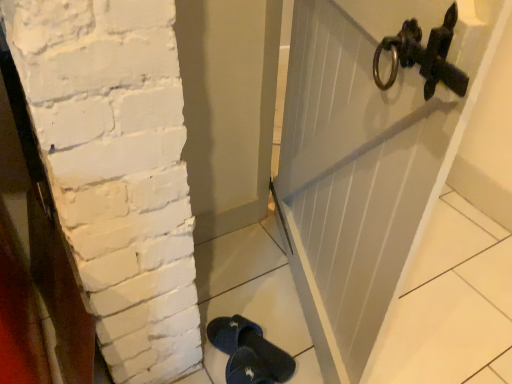
What do you see at coordinates (355, 170) in the screenshot? I see `white painted wood door at upper right` at bounding box center [355, 170].

Image resolution: width=512 pixels, height=384 pixels. Find the location of `white painted wood door at upper right`. white painted wood door at upper right is located at coordinates (355, 170).

In order to face white painted wood door at upper right, should I rotate leftwards or rightwards?

A 13.536 degree turn to the right will do.

What is the approximate width of white painted wood door at upper right?

It is 5.32 inches.

Measure the distance between white painted wood door at upper right and camera.

46.15 centimeters.

What do you see at coordinates (249, 352) in the screenshot? I see `dark blue fabric slipper at lower center` at bounding box center [249, 352].

At what (x,y) coordinates should I click in order to perform the action: click on dark blue fabric slipper at lower center. Please return your answer as a coordinate pair (x, y). The width and height of the screenshot is (512, 384). Looking at the image, I should click on (249, 352).

The width and height of the screenshot is (512, 384). I want to click on white painted wood door at upper right, so click(x=355, y=170).

Considering the positions of objects dark blue fabric slipper at lower center and white painted wood door at upper right in the image provided, who is more to the right, dark blue fabric slipper at lower center or white painted wood door at upper right?

Positioned to the right is white painted wood door at upper right.

Which object is further away from the camera, dark blue fabric slipper at lower center or white painted wood door at upper right?

white painted wood door at upper right is further away from the camera.

Which is behind, point (275, 376) or point (352, 58)?

The point (275, 376) is farther.

From the image's perspective, is dark blue fabric slipper at lower center positioned above or below white painted wood door at upper right?

Based on their image positions, dark blue fabric slipper at lower center is located beneath white painted wood door at upper right.

From a real-world perspective, is dark blue fabric slipper at lower center below white painted wood door at upper right?

Yes, from a real-world perspective, dark blue fabric slipper at lower center is below white painted wood door at upper right.

Considering the sizes of dark blue fabric slipper at lower center and white painted wood door at upper right in the image, is dark blue fabric slipper at lower center wider or thinner than white painted wood door at upper right?

dark blue fabric slipper at lower center is wider than white painted wood door at upper right.

In terms of height, does dark blue fabric slipper at lower center look taller or shorter compared to white painted wood door at upper right?

dark blue fabric slipper at lower center is shorter than white painted wood door at upper right.

Based on the photo, between dark blue fabric slipper at lower center and white painted wood door at upper right, which one has larger size?

With larger size is white painted wood door at upper right.

Would you say dark blue fabric slipper at lower center contains white painted wood door at upper right?

No, white painted wood door at upper right is not surrounded by dark blue fabric slipper at lower center.

Are dark blue fabric slipper at lower center and white painted wood door at upper right making contact?

No, dark blue fabric slipper at lower center is not with white painted wood door at upper right.

Is dark blue fabric slipper at lower center positioned with its back to white painted wood door at upper right?

dark blue fabric slipper at lower center is not turned away from white painted wood door at upper right.

How much distance is there between dark blue fabric slipper at lower center and white painted wood door at upper right?

dark blue fabric slipper at lower center and white painted wood door at upper right are 19.39 inches apart.

In order to click on footwear below the white painted wood door at upper right (from the image's perspective) in this screenshot , I will do `click(249, 352)`.

Is white painted wood door at upper right to the left of dark blue fabric slipper at lower center from the viewer's perspective?

In fact, white painted wood door at upper right is to the right of dark blue fabric slipper at lower center.

Which object is further away from the camera, white painted wood door at upper right or dark blue fabric slipper at lower center?

white painted wood door at upper right.

Does point (366, 168) come in front of point (243, 331)?

Yes, it is.

From the image's perspective, which is above, white painted wood door at upper right or dark blue fabric slipper at lower center?

From the image's view, white painted wood door at upper right is above.

From a real-world perspective, is white painted wood door at upper right over dark blue fabric slipper at lower center?

Yes, from a real-world perspective, white painted wood door at upper right is above dark blue fabric slipper at lower center.

Is white painted wood door at upper right wider or thinner than dark blue fabric slipper at lower center?

Clearly, white painted wood door at upper right has less width compared to dark blue fabric slipper at lower center.

Is white painted wood door at upper right shorter than dark blue fabric slipper at lower center?

Incorrect, the height of white painted wood door at upper right does not fall short of that of dark blue fabric slipper at lower center.

Considering the relative sizes of white painted wood door at upper right and dark blue fabric slipper at lower center in the image provided, is white painted wood door at upper right bigger than dark blue fabric slipper at lower center?

Yes, white painted wood door at upper right is bigger than dark blue fabric slipper at lower center.

Could dark blue fabric slipper at lower center be considered to be inside white painted wood door at upper right?

No, white painted wood door at upper right does not contain dark blue fabric slipper at lower center.

Is white painted wood door at upper right not near dark blue fabric slipper at lower center?

No, white painted wood door at upper right is not far from dark blue fabric slipper at lower center.

Is white painted wood door at upper right facing towards dark blue fabric slipper at lower center?

No, white painted wood door at upper right is not oriented towards dark blue fabric slipper at lower center.

What's the angular difference between white painted wood door at upper right and dark blue fabric slipper at lower center's facing directions?

There is a 0.679-degree angle between the facing directions of white painted wood door at upper right and dark blue fabric slipper at lower center.

Find the location of a particular element. footwear below the white painted wood door at upper right (from a real-world perspective) is located at coordinates (249, 352).

This screenshot has height=384, width=512. Find the location of `door above the dark blue fabric slipper at lower center (from the image's perspective)`. door above the dark blue fabric slipper at lower center (from the image's perspective) is located at coordinates (355, 170).

Locate an element on the screen. door on the right of dark blue fabric slipper at lower center is located at coordinates (355, 170).